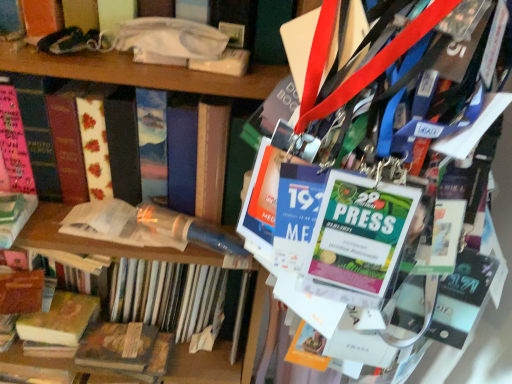
Image resolution: width=512 pixels, height=384 pixels. I want to click on wooden book at lower left, which is the 1th book in bottom-to-top order, so click(127, 349).

Describe the element at coordinates (60, 320) in the screenshot. I see `yellow paperback book at lower left, which appears as the third book when viewed from the top` at that location.

Identify the location of hardcover book at left, acting as the first book starting from the top. (49, 135).

Is wooden book at lower left, which is the 1th book in bottom-to-top order, inside the boundaries of hardcover book at left, which is counted as the 4th book, starting from the bottom, or outside?

wooden book at lower left, which is the 1th book in bottom-to-top order, is not enclosed by hardcover book at left, which is counted as the 4th book, starting from the bottom.

Considering the positions of objects wooden book at lower left, which is the 1th book in bottom-to-top order, and hardcover book at left, which is counted as the 4th book, starting from the bottom, in the image provided, who is behind, wooden book at lower left, which is the 1th book in bottom-to-top order, or hardcover book at left, which is counted as the 4th book, starting from the bottom,?

wooden book at lower left, which is the 1th book in bottom-to-top order, is more distant.

Can you confirm if wooden book at lower left, which is the 1th book in bottom-to-top order, is bigger than hardcover book at left, which is counted as the 4th book, starting from the bottom?

No, wooden book at lower left, which is the 1th book in bottom-to-top order, is not bigger than hardcover book at left, which is counted as the 4th book, starting from the bottom.

Looking at this image, which of these two, yellow paperback book at lower left, which ranks as the 2th book in bottom-to-top order, or translucent plastic tube at center, the second book in the top-to-bottom sequence, is wider?

translucent plastic tube at center, the second book in the top-to-bottom sequence.

Is yellow paperback book at lower left, which appears as the third book when viewed from the top, located outside translucent plastic tube at center, which is counted as the 3th book, starting from the bottom?

Indeed, yellow paperback book at lower left, which appears as the third book when viewed from the top, is completely outside translucent plastic tube at center, which is counted as the 3th book, starting from the bottom.

Between yellow paperback book at lower left, which ranks as the 2th book in bottom-to-top order, and translucent plastic tube at center, the second book in the top-to-bottom sequence, which one appears on the right side from the viewer's perspective?

Positioned to the right is translucent plastic tube at center, the second book in the top-to-bottom sequence.

Can we say translucent plastic tube at center, the second book in the top-to-bottom sequence, lies outside yellow paperback book at lower left, which ranks as the 2th book in bottom-to-top order?

That's correct, translucent plastic tube at center, the second book in the top-to-bottom sequence, is outside of yellow paperback book at lower left, which ranks as the 2th book in bottom-to-top order.

Between translucent plastic tube at center, the second book in the top-to-bottom sequence, and yellow paperback book at lower left, which ranks as the 2th book in bottom-to-top order, which one has more height?

Standing taller between the two is translucent plastic tube at center, the second book in the top-to-bottom sequence.

Consider the image. From a real-world perspective, is translucent plastic tube at center, which is counted as the 3th book, starting from the bottom, physically located above or below yellow paperback book at lower left, which appears as the third book when viewed from the top?

translucent plastic tube at center, which is counted as the 3th book, starting from the bottom, is situated higher than yellow paperback book at lower left, which appears as the third book when viewed from the top, in the real world.

Which is more to the right, translucent plastic tube at center, which is counted as the 3th book, starting from the bottom, or yellow paperback book at lower left, which appears as the third book when viewed from the top?

From the viewer's perspective, translucent plastic tube at center, which is counted as the 3th book, starting from the bottom, appears more on the right side.

Locate an element on the screen. book that is the 1st object to the left of the translucent plastic tube at center, the second book in the top-to-bottom sequence, starting at the anchor is located at coordinates (49, 135).

Are hardcover book at left, acting as the first book starting from the top, and translucent plastic tube at center, which is counted as the 3th book, starting from the bottom, beside each other?

hardcover book at left, acting as the first book starting from the top, is not next to translucent plastic tube at center, which is counted as the 3th book, starting from the bottom, and they're not touching.

Which of these two, hardcover book at left, acting as the first book starting from the top, or translucent plastic tube at center, which is counted as the 3th book, starting from the bottom, stands shorter?

Standing shorter between the two is translucent plastic tube at center, which is counted as the 3th book, starting from the bottom.

Can you confirm if hardcover book at left, acting as the first book starting from the top, is smaller than translucent plastic tube at center, which is counted as the 3th book, starting from the bottom?

No, hardcover book at left, acting as the first book starting from the top, is not smaller than translucent plastic tube at center, which is counted as the 3th book, starting from the bottom.

From a real-world perspective, who is located lower, hardcover book at left, which is counted as the 4th book, starting from the bottom, or wooden book at lower left, which is the 1th book in bottom-to-top order?

wooden book at lower left, which is the 1th book in bottom-to-top order, is physically lower.

From the image's perspective, between hardcover book at left, which is counted as the 4th book, starting from the bottom, and wooden book at lower left, the fourth book when ordered from top to bottom, which one is located above?

hardcover book at left, which is counted as the 4th book, starting from the bottom, is shown above in the image.

Considering the positions of point (129, 118) and point (122, 356), is point (129, 118) closer or farther from the camera than point (122, 356)?

Clearly, point (129, 118) is closer to the camera than point (122, 356).

Who is bigger, hardcover book at left, which is counted as the 4th book, starting from the bottom, or wooden book at lower left, the fourth book when ordered from top to bottom?

hardcover book at left, which is counted as the 4th book, starting from the bottom, is bigger.

Can you confirm if translucent plastic tube at center, the second book in the top-to-bottom sequence, is smaller than wooden book at lower left, which is the 1th book in bottom-to-top order?

No, translucent plastic tube at center, the second book in the top-to-bottom sequence, is not smaller than wooden book at lower left, which is the 1th book in bottom-to-top order.

From the image's perspective, is translucent plastic tube at center, the second book in the top-to-bottom sequence, over wooden book at lower left, the fourth book when ordered from top to bottom?

Yes, from the image's perspective, translucent plastic tube at center, the second book in the top-to-bottom sequence, is above wooden book at lower left, the fourth book when ordered from top to bottom.

Locate an element on the screen. This screenshot has height=384, width=512. the 2nd book located beneath the translucent plastic tube at center, the second book in the top-to-bottom sequence (from a real-world perspective) is located at coordinates (127, 349).

Is point (154, 269) behind point (131, 363)?

That is True.

Is wooden book at lower left, the fourth book when ordered from top to bottom, next to translucent plastic tube at center, which is counted as the 3th book, starting from the bottom, and touching it?

Absolutely, wooden book at lower left, the fourth book when ordered from top to bottom, is next to and touching translucent plastic tube at center, which is counted as the 3th book, starting from the bottom.

Based on the photo, visually, is wooden book at lower left, which is the 1th book in bottom-to-top order, positioned to the left or to the right of translucent plastic tube at center, the second book in the top-to-bottom sequence?

wooden book at lower left, which is the 1th book in bottom-to-top order, is positioned on translucent plastic tube at center, the second book in the top-to-bottom sequence,'s left side.

Is wooden book at lower left, the fourth book when ordered from top to bottom, bigger than translucent plastic tube at center, the second book in the top-to-bottom sequence?

Actually, wooden book at lower left, the fourth book when ordered from top to bottom, might be smaller than translucent plastic tube at center, the second book in the top-to-bottom sequence.

Which object is closer to the camera, wooden book at lower left, the fourth book when ordered from top to bottom, or translucent plastic tube at center, the second book in the top-to-bottom sequence?

translucent plastic tube at center, the second book in the top-to-bottom sequence, is more forward.

Identify the location of the 3rd book below the hardcover book at left, acting as the first book starting from the top (from the image's perspective). (127, 349).

Image resolution: width=512 pixels, height=384 pixels. In order to click on the 2nd book behind the translucent plastic tube at center, the second book in the top-to-bottom sequence, starting your count from the anchor in this screenshot , I will do `click(60, 320)`.

Based on their spatial positions, is translucent plastic tube at center, the second book in the top-to-bottom sequence, or hardcover book at left, acting as the first book starting from the top, closer to wooden book at lower left, which is the 1th book in bottom-to-top order?

translucent plastic tube at center, the second book in the top-to-bottom sequence, lies closer to wooden book at lower left, which is the 1th book in bottom-to-top order, than the other object.

From the image, which object appears to be farther from yellow paperback book at lower left, which appears as the third book when viewed from the top, hardcover book at left, acting as the first book starting from the top, or wooden book at lower left, which is the 1th book in bottom-to-top order?

hardcover book at left, acting as the first book starting from the top, is positioned further to the anchor yellow paperback book at lower left, which appears as the third book when viewed from the top.

Based on their spatial positions, is wooden book at lower left, the fourth book when ordered from top to bottom, or translucent plastic tube at center, the second book in the top-to-bottom sequence, further from yellow paperback book at lower left, which ranks as the 2th book in bottom-to-top order?

translucent plastic tube at center, the second book in the top-to-bottom sequence.

From the image, which object appears to be nearer to translucent plastic tube at center, the second book in the top-to-bottom sequence, yellow paperback book at lower left, which appears as the third book when viewed from the top, or hardcover book at left, acting as the first book starting from the top?

yellow paperback book at lower left, which appears as the third book when viewed from the top, is closer to translucent plastic tube at center, the second book in the top-to-bottom sequence.

Which object lies further to the anchor point wooden book at lower left, which is the 1th book in bottom-to-top order, hardcover book at left, acting as the first book starting from the top, or yellow paperback book at lower left, which appears as the third book when viewed from the top?

hardcover book at left, acting as the first book starting from the top, is further to wooden book at lower left, which is the 1th book in bottom-to-top order.

Consider the image. Which object lies further to the anchor point translucent plastic tube at center, which is counted as the 3th book, starting from the bottom, wooden book at lower left, the fourth book when ordered from top to bottom, or hardcover book at left, which is counted as the 4th book, starting from the bottom?

hardcover book at left, which is counted as the 4th book, starting from the bottom, lies further to translucent plastic tube at center, which is counted as the 3th book, starting from the bottom, than the other object.

Estimate the real-world distances between objects in this image. Which object is further from hardcover book at left, acting as the first book starting from the top, translucent plastic tube at center, which is counted as the 3th book, starting from the bottom, or wooden book at lower left, which is the 1th book in bottom-to-top order?

Among the two, wooden book at lower left, which is the 1th book in bottom-to-top order, is located further to hardcover book at left, acting as the first book starting from the top.

Estimate the real-world distances between objects in this image. Which object is further from wooden book at lower left, the fourth book when ordered from top to bottom, yellow paperback book at lower left, which ranks as the 2th book in bottom-to-top order, or translucent plastic tube at center, the second book in the top-to-bottom sequence?

yellow paperback book at lower left, which ranks as the 2th book in bottom-to-top order, is positioned further to the anchor wooden book at lower left, the fourth book when ordered from top to bottom.

This screenshot has height=384, width=512. I want to click on book between hardcover book at left, which is counted as the 4th book, starting from the bottom, and yellow paperback book at lower left, which appears as the third book when viewed from the top, in the up-down direction, so click(167, 295).